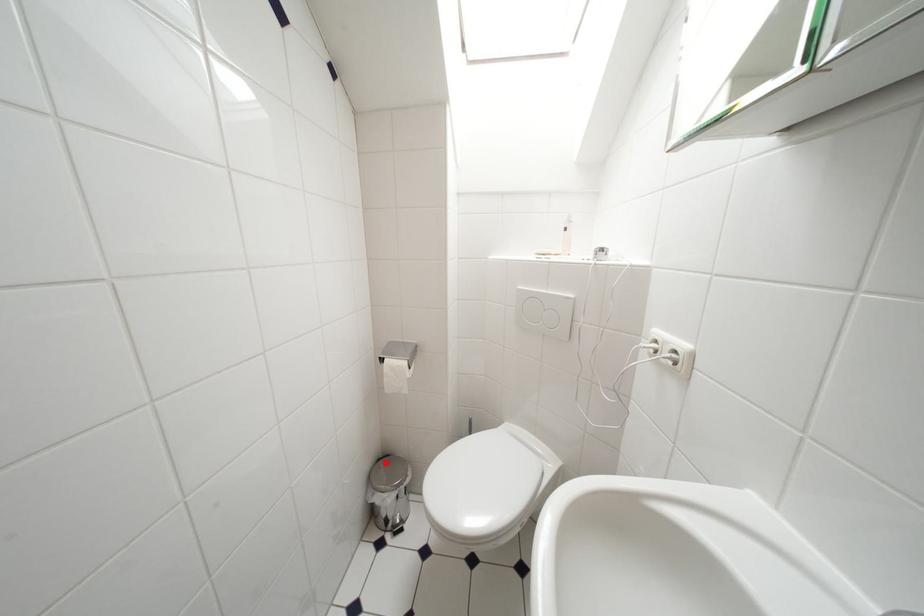
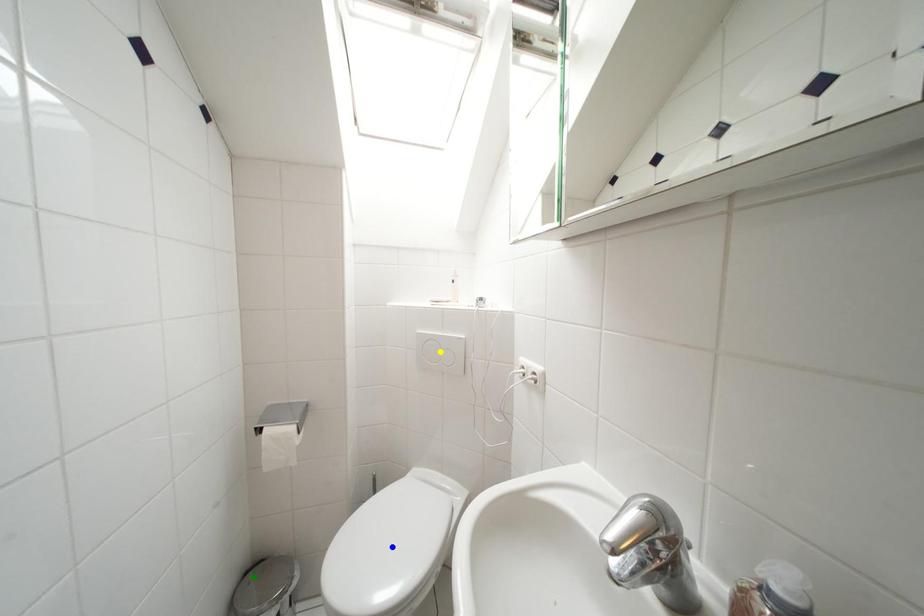
Question: I am providing you with two images of the same scene from different viewpoints. A red point is marked on the first image. You are given multiple points on the second image. In image 2, which mark is for the same physical point as the one in image 1?

Choices:
 (A) green point
 (B) yellow point
 (C) blue point

Answer: (A)